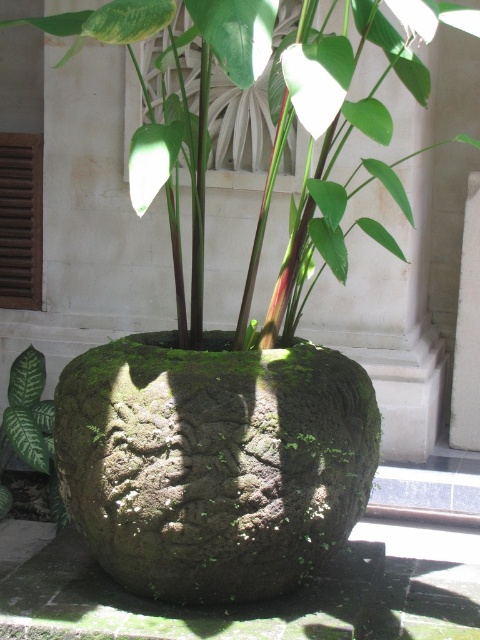
Question: Which point is closer to the camera taking this photo?

Choices:
 (A) tap(20, 440)
 (B) tap(387, 22)

Answer: (B)

Question: Which point is farther from the camera taking this photo?

Choices:
 (A) (22, 388)
 (B) (87, 12)

Answer: (A)

Question: In this image, where is green mossy stone pot at center located relative to green matte leaf at lower left?

Choices:
 (A) below
 (B) above

Answer: (B)

Question: Is green mossy stone pot at center below green matte leaf at lower left?

Choices:
 (A) no
 (B) yes

Answer: (A)

Question: Considering the relative positions of green mossy stone pot at center and green matte leaf at lower left in the image provided, where is green mossy stone pot at center located with respect to green matte leaf at lower left?

Choices:
 (A) right
 (B) left

Answer: (A)

Question: Which object is closer to the camera taking this photo?

Choices:
 (A) green matte leaf at lower left
 (B) green mossy stone pot at center

Answer: (B)